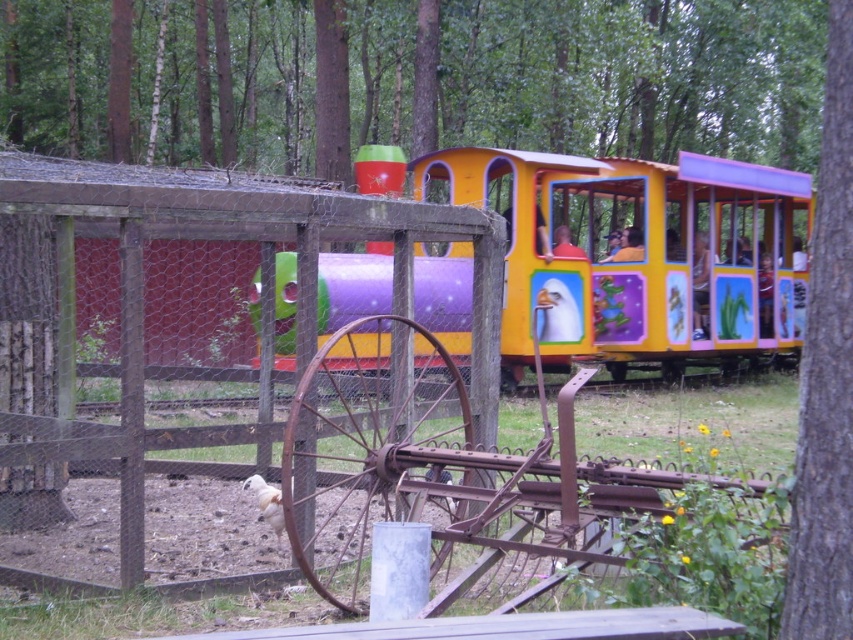
You are planning to take a photo of the matte plastic train at center and the green leafy tree at right from a distance. Which object should you focus on first if you want to capture both in the frame without zooming in or out?

The matte plastic train at center is larger in size compared to the green leafy tree at right, so you should focus on the matte plastic train at center first to ensure it fits properly in the frame before adjusting for the smaller tree.

You are a parent trying to decide whether to let your child play near the matte plastic train at center and the green leafy tree at right. Considering their heights, which one is taller?

The matte plastic train at center is much taller than the green leafy tree at right, so the train is taller.

You are a parent trying to decide whether to let your child play near the matte plastic train at center and the green leafy tree at right. Based on their positions, which object is closer to the fence where the dog is sniffing?

The matte plastic train at center is positioned on the right side of the green leafy tree at right, so the green leafy tree at right is closer to the fence where the dog is sniffing.